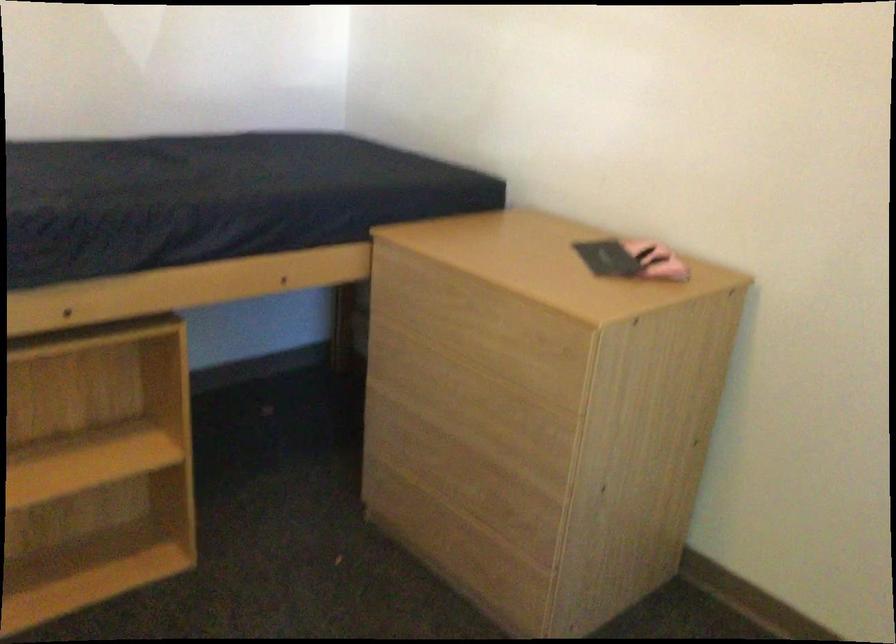
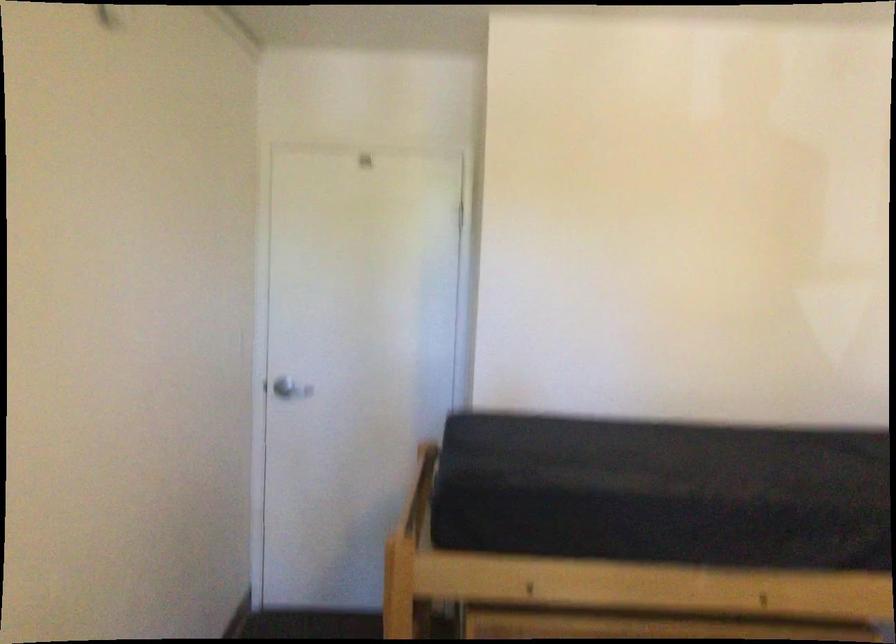
How did the camera likely rotate?

The camera rotated toward left-up.